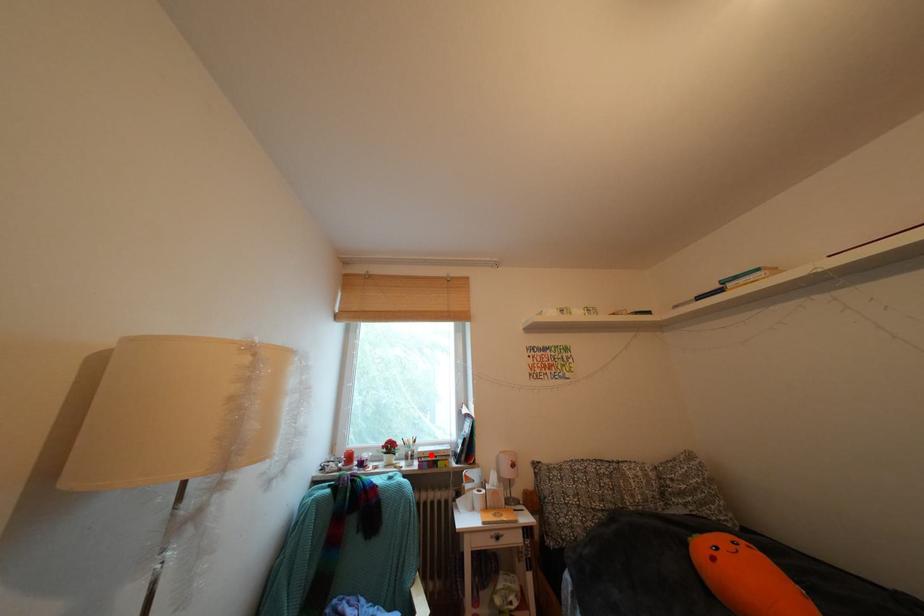
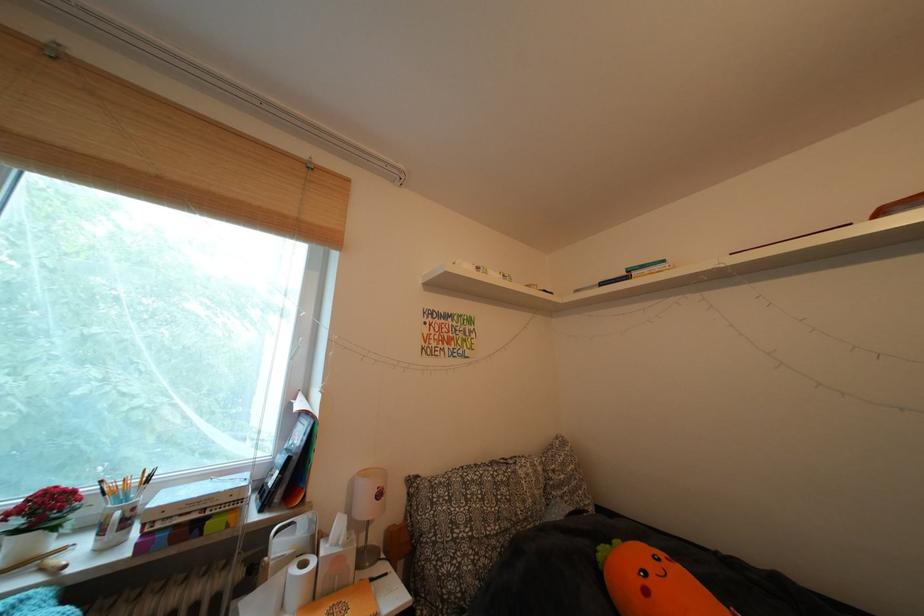
Question: I am providing you with two images of the same scene from different viewpoints. A red point is marked on the first image. Can you still see the location of the red point in image 2?

Choices:
 (A) Yes
 (B) No

Answer: (A)